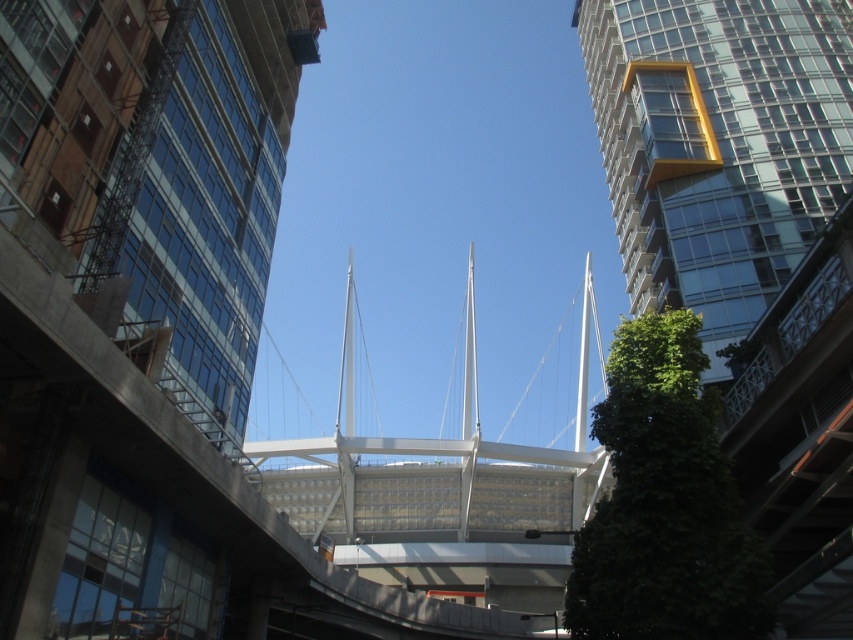
You are an architect evaluating the structural integrity of the clear glass building at upper left and the transparent glass tower at right. Which building has a narrower base? Please consider their widths as seen from this perspective.

The clear glass building at upper left is thinner than the transparent glass tower at right, so its base is narrower.

You are an architect evaluating the urban skyline. Based on the scene, which of the two buildings, the clear glass building at upper left or the transparent glass tower at right, would require less material for a similar height due to its size?

The clear glass building at upper left requires less material for a similar height because it is smaller in size compared to the transparent glass tower at right.